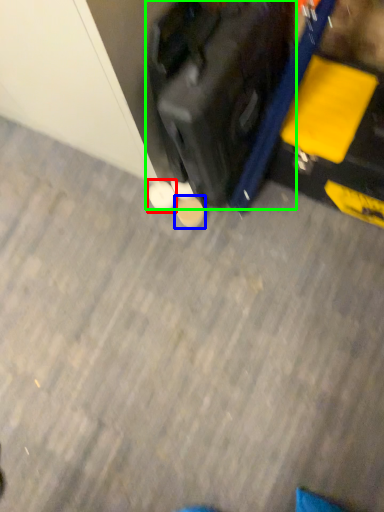
Question: Which object is positioned closest to footwear (highlighted by a red box)? Select from footwear (highlighted by a blue box) and suitcase (highlighted by a green box).

Choices:
 (A) footwear
 (B) suitcase

Answer: (A)